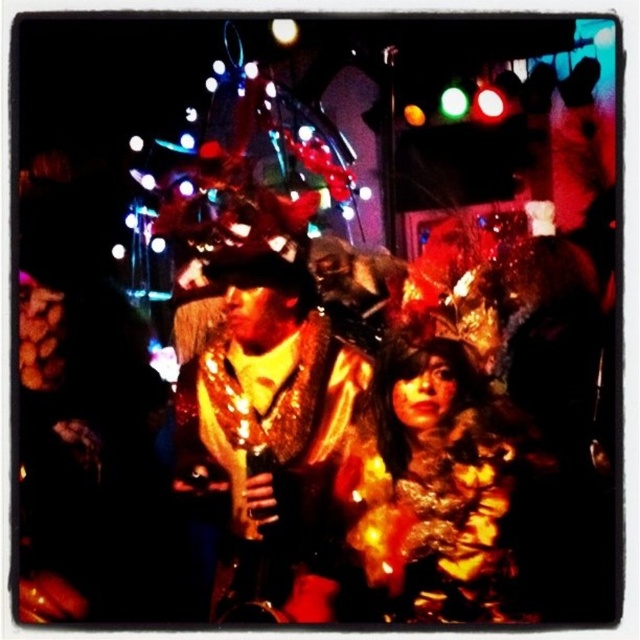
Is shiny gold jacket at center below fuzzy fur coat at center?

No, shiny gold jacket at center is not below fuzzy fur coat at center.

Which is more to the right, shiny gold jacket at center or fuzzy fur coat at center?

Positioned to the right is fuzzy fur coat at center.

Locate an element on the screen. The height and width of the screenshot is (640, 640). shiny gold jacket at center is located at coordinates tap(264, 419).